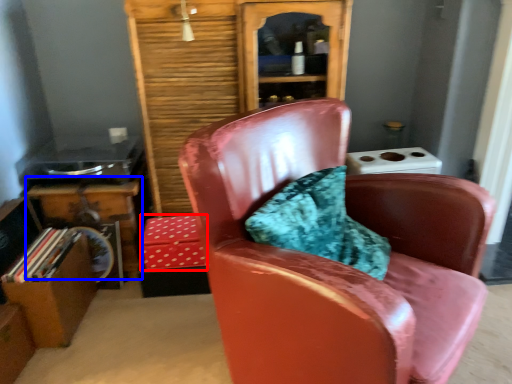
Question: Among these objects, which one is farthest to the camera, box (highlighted by a red box) or table (highlighted by a blue box)?

Choices:
 (A) box
 (B) table

Answer: (B)